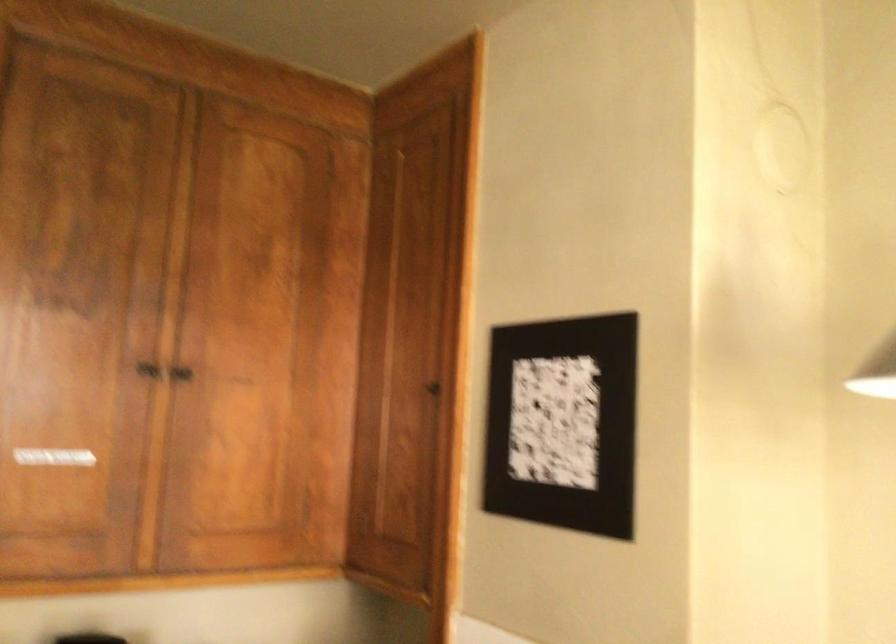
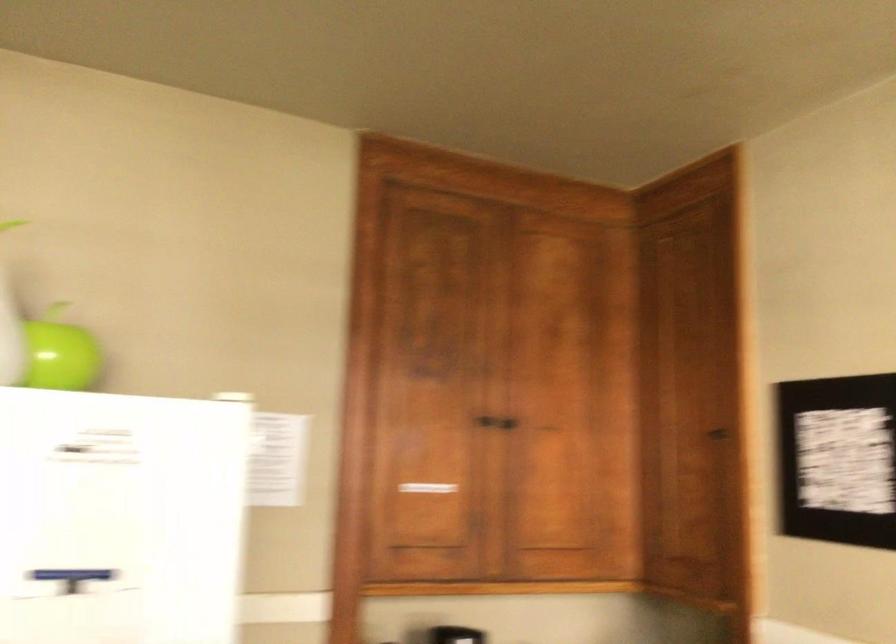
Where in the second image is the point corresponding to the point at 444,386 from the first image?

(719, 436)